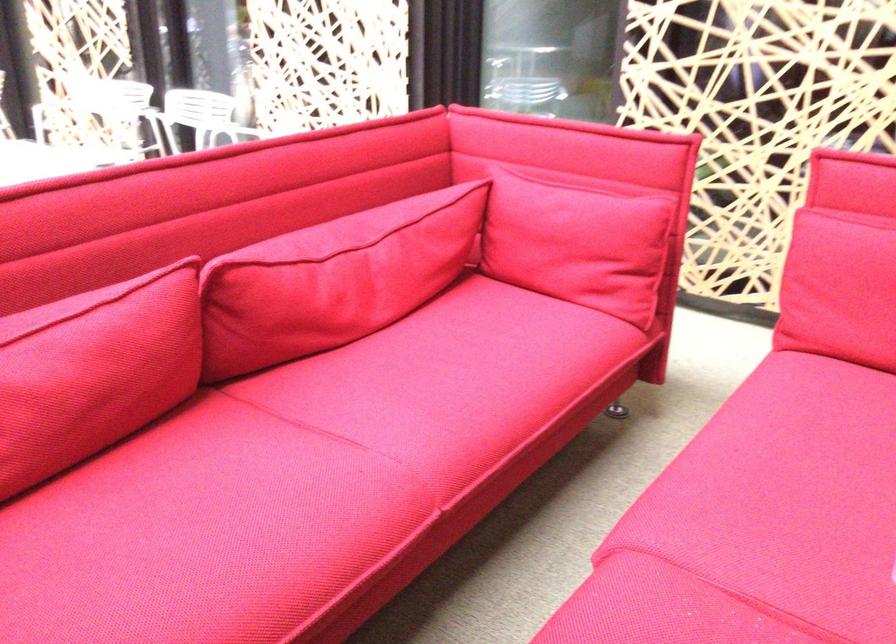
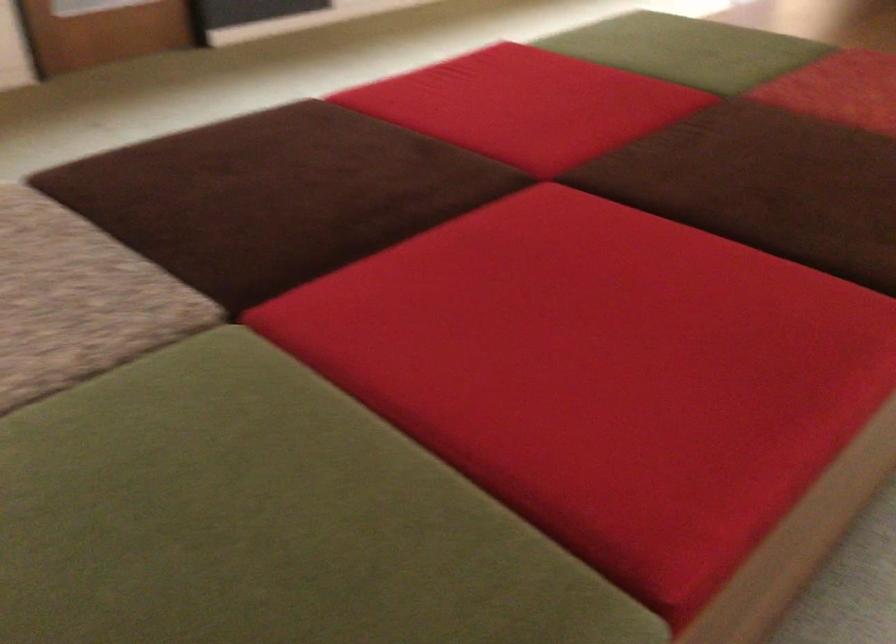
First-person continuous shooting, in which direction is the camera rotating?

The camera's rotation is toward left-down.